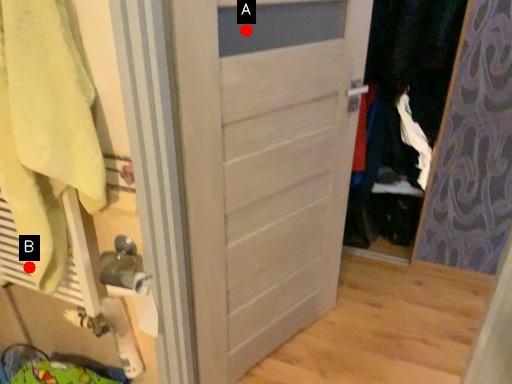
Question: Two points are circled on the image, labeled by A and B beside each circle. Which point is farther from the camera taking this photo?

Choices:
 (A) A is further
 (B) B is further

Answer: (A)